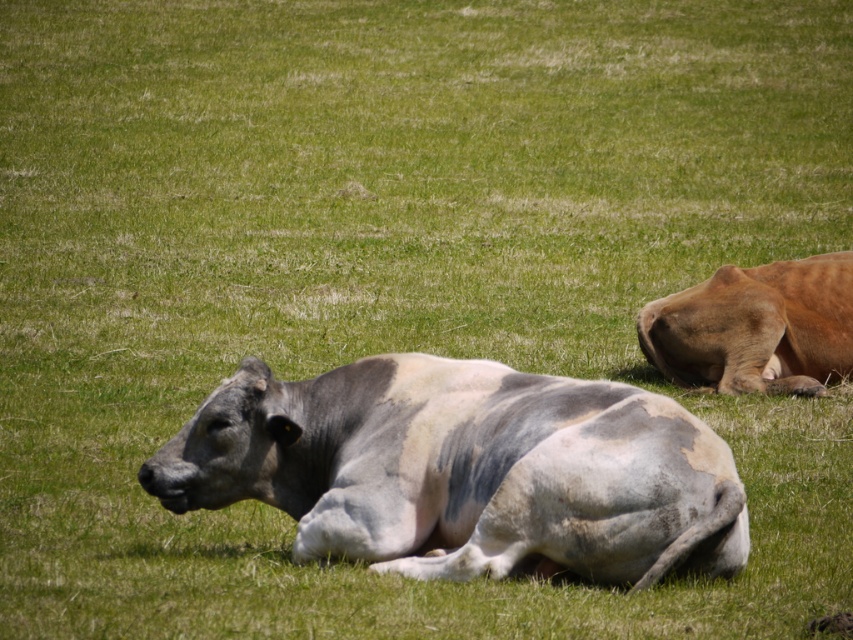
Between speckled gray cow at center and brown smooth cow at right, which one is positioned higher?

Positioned higher is brown smooth cow at right.

Between point (369, 445) and point (717, 349), which one is positioned behind?

The point (717, 349) is behind.

Is point (299, 472) farther from viewer compared to point (704, 352)?

No, it is in front of (704, 352).

You are a GUI agent. You are given a task and a screenshot of the screen. Output one action in this format:
    pyautogui.click(x=<x>, y=<y>)
    Task: Click on the speckled gray cow at center
    
    Given the screenshot: What is the action you would take?
    pyautogui.click(x=463, y=468)